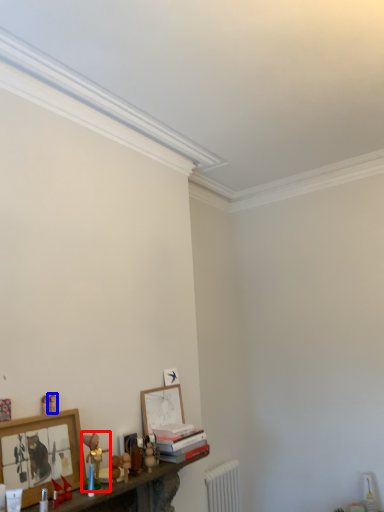
Question: Which point is further to the camera, toy (highlighted by a red box) or toy (highlighted by a blue box)?

Choices:
 (A) toy
 (B) toy

Answer: (B)